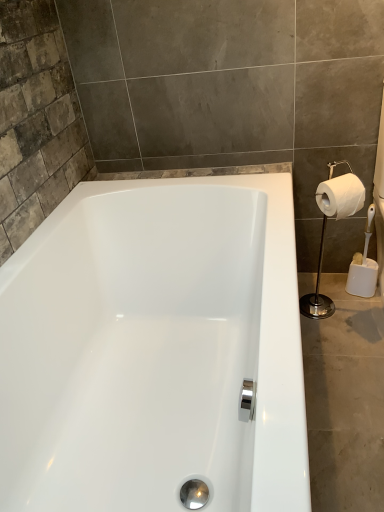
Question: From a real-world perspective, is white glossy toilet paper holder at right on top of white matte toilet paper at right?

Choices:
 (A) yes
 (B) no

Answer: (B)

Question: Can you confirm if white glossy toilet paper holder at right is wider than white matte toilet paper at right?

Choices:
 (A) no
 (B) yes

Answer: (B)

Question: Can you confirm if white glossy toilet paper holder at right is shorter than white matte toilet paper at right?

Choices:
 (A) no
 (B) yes

Answer: (A)

Question: Does white glossy toilet paper holder at right come in front of white matte toilet paper at right?

Choices:
 (A) yes
 (B) no

Answer: (B)

Question: Does white glossy toilet paper holder at right lie behind white matte toilet paper at right?

Choices:
 (A) no
 (B) yes

Answer: (B)

Question: From a real-world perspective, is white glossy toilet paper holder at right physically below white matte toilet paper at right?

Choices:
 (A) no
 (B) yes

Answer: (B)

Question: Is white matte toilet paper at right further to the viewer compared to white glossy toilet paper holder at right?

Choices:
 (A) no
 (B) yes

Answer: (A)

Question: Is the depth of white matte toilet paper at right less than that of white glossy toilet paper holder at right?

Choices:
 (A) yes
 (B) no

Answer: (A)

Question: Is white matte toilet paper at right bigger than white glossy toilet paper holder at right?

Choices:
 (A) no
 (B) yes

Answer: (A)

Question: Is white matte toilet paper at right positioned with its back to white glossy toilet paper holder at right?

Choices:
 (A) no
 (B) yes

Answer: (B)

Question: From the image's perspective, is white matte toilet paper at right beneath white glossy toilet paper holder at right?

Choices:
 (A) no
 (B) yes

Answer: (A)

Question: Considering the relative positions of white matte toilet paper at right and white glossy toilet paper holder at right in the image provided, is white matte toilet paper at right to the left of white glossy toilet paper holder at right from the viewer's perspective?

Choices:
 (A) yes
 (B) no

Answer: (B)

Question: Which is correct: white glossy toilet paper holder at right is inside white matte toilet paper at right, or outside of it?

Choices:
 (A) inside
 (B) outside

Answer: (B)